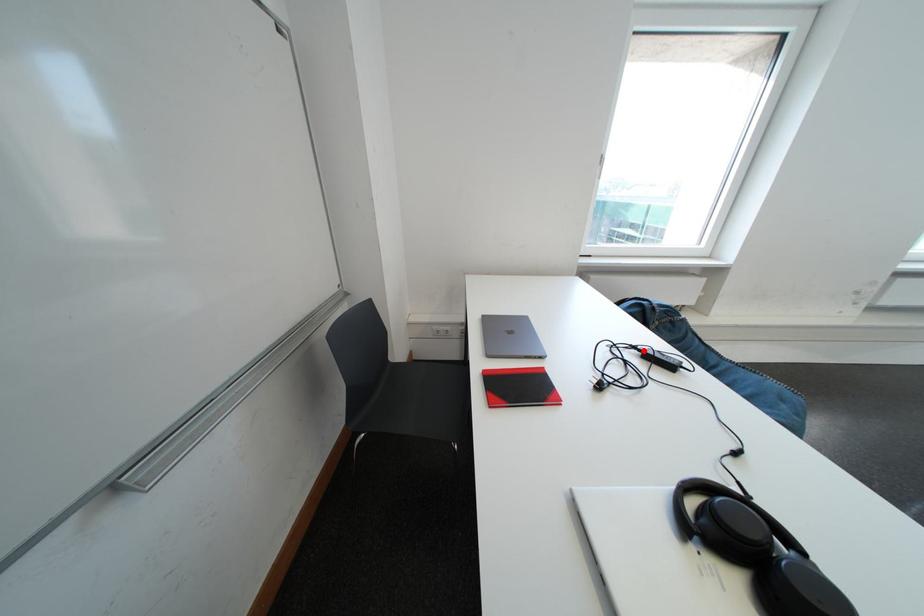
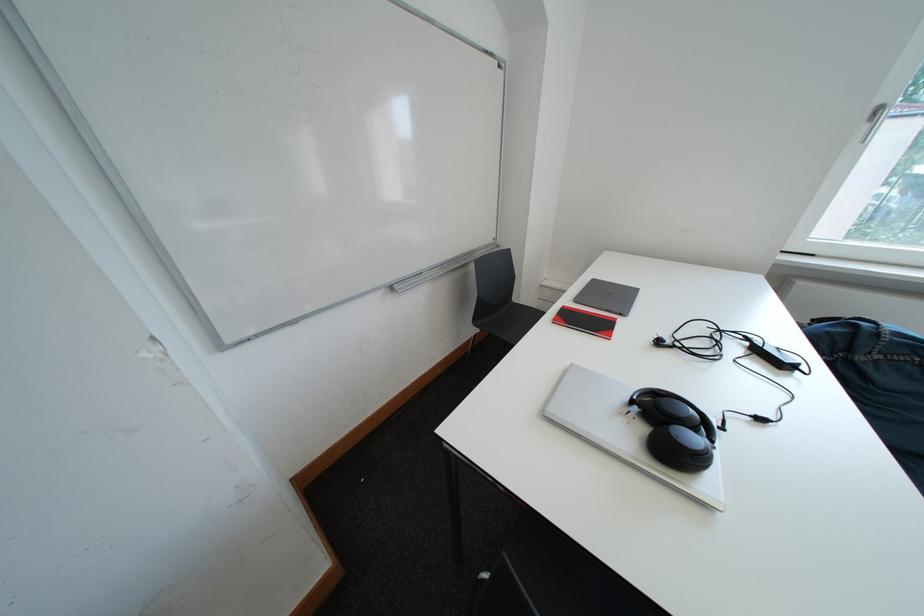
The point at the highlighted location is marked in the first image. Where is the corresponding point in the second image?

(758, 342)